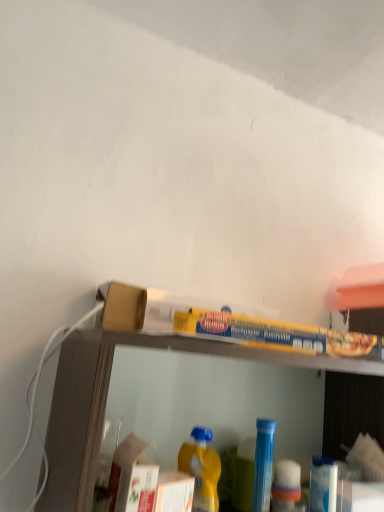
Question: Considering the positions of yellow matte plastic bottle at lower center, which is the 2th bottle from back to front, and clear plastic shelf at upper center in the image, is yellow matte plastic bottle at lower center, which is the 2th bottle from back to front, bigger or smaller than clear plastic shelf at upper center?

Choices:
 (A) big
 (B) small

Answer: (B)

Question: Is point (200, 444) positioned closer to the camera than point (77, 444)?

Choices:
 (A) closer
 (B) farther

Answer: (B)

Question: Estimate the real-world distances between objects in this image. Which object is farther from the yellow matte plastic bottle at lower center, marked as the 1th bottle in a left-to-right arrangement?

Choices:
 (A) clear plastic shelf at upper center
 (B) blue plastic bottle at center, marked as the second bottle in a front-to-back arrangement

Answer: (A)

Question: Based on their relative distances, which object is nearer to the clear plastic shelf at upper center?

Choices:
 (A) yellow matte plastic bottle at lower center, which is the 1th bottle in front-to-back order
 (B) blue plastic bottle at center, the 1th bottle from the back

Answer: (A)